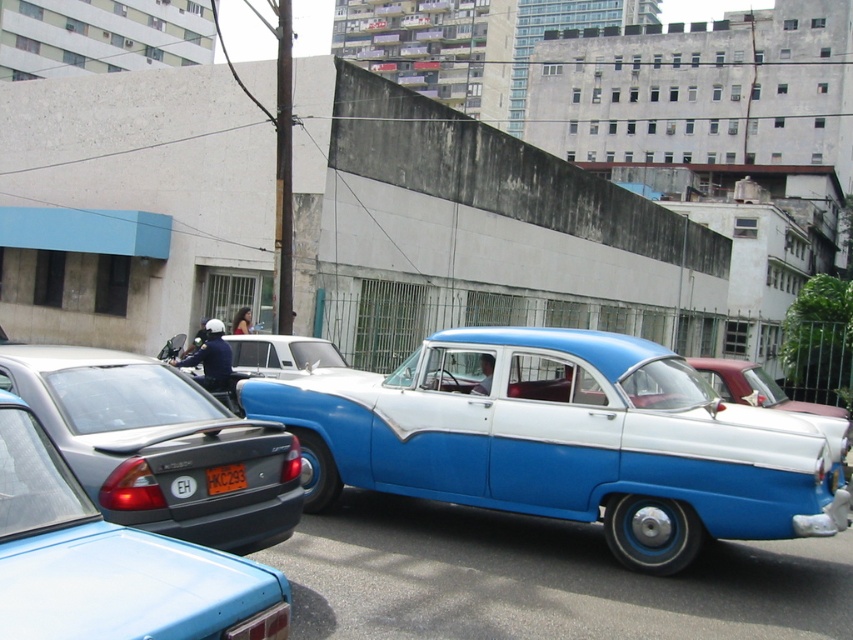
You are a delivery drone flying over an urban area. You need to deliver a package to the blue metallic car at center. According to the coordinates provided, where exactly is the blue metallic car positioned?

The blue metallic car at center is located at point coordinates of (566, 440).

You are a delivery person who needs to park your 2.5 meters wide truck in the parking space next to the blue metallic car at center and the yellow plastic license plate at center. Can you fit your truck between them without touching either the car or the license plate?

The blue metallic car at center might be wider than yellow plastic license plate at center, so it is uncertain whether the truck can fit between them. You should measure the distance first before attempting to park.

You are a delivery driver who needs to place a large package on the roof of the blue metallic car at center. The package is 1.5 meters in height. Can the package fit on the roof without exceeding the height limit imposed by the yellow plastic license plate at center?

The blue metallic car at center is larger in size compared to the yellow plastic license plate at center. However, the height of the license plate is not specified, so it is impossible to determine if the package will fit without additional information.